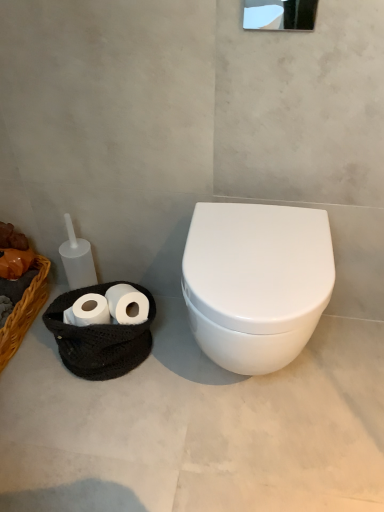
Question: Is white glossy mirror at upper center not near braided wicker basket at left?

Choices:
 (A) no
 (B) yes

Answer: (B)

Question: Does white glossy mirror at upper center have a lesser height compared to braided wicker basket at left?

Choices:
 (A) yes
 (B) no

Answer: (A)

Question: Is white glossy mirror at upper center behind braided wicker basket at left?

Choices:
 (A) no
 (B) yes

Answer: (A)

Question: Does white glossy mirror at upper center have a greater height compared to braided wicker basket at left?

Choices:
 (A) no
 (B) yes

Answer: (A)

Question: From a real-world perspective, is white glossy mirror at upper center physically above braided wicker basket at left?

Choices:
 (A) yes
 (B) no

Answer: (A)

Question: Is point (16, 309) positioned closer to the camera than point (87, 374)?

Choices:
 (A) closer
 (B) farther

Answer: (B)

Question: Is braided wicker basket at left wider or thinner than white matte toilet paper at lower left?

Choices:
 (A) wide
 (B) thin

Answer: (A)

Question: From the image's perspective, is braided wicker basket at left positioned above or below white matte toilet paper at lower left?

Choices:
 (A) above
 (B) below

Answer: (A)

Question: Looking at the image, does braided wicker basket at left seem bigger or smaller compared to white matte toilet paper at lower left?

Choices:
 (A) small
 (B) big

Answer: (B)

Question: From a real-world perspective, is white glossy toilet at right positioned above or below white glossy mirror at upper center?

Choices:
 (A) below
 (B) above

Answer: (A)

Question: Is white glossy toilet at right situated inside white glossy mirror at upper center or outside?

Choices:
 (A) inside
 (B) outside

Answer: (B)

Question: From the image's perspective, is white glossy toilet at right located above or below white glossy mirror at upper center?

Choices:
 (A) above
 (B) below

Answer: (B)

Question: Based on their positions, is white glossy toilet at right located to the left or right of white glossy mirror at upper center?

Choices:
 (A) right
 (B) left

Answer: (B)

Question: In the image, is white matte toilet paper at lower left positioned in front of or behind white glossy mirror at upper center?

Choices:
 (A) behind
 (B) front

Answer: (A)

Question: Considering the positions of white matte toilet paper at lower left and white glossy mirror at upper center in the image, is white matte toilet paper at lower left taller or shorter than white glossy mirror at upper center?

Choices:
 (A) tall
 (B) short

Answer: (B)